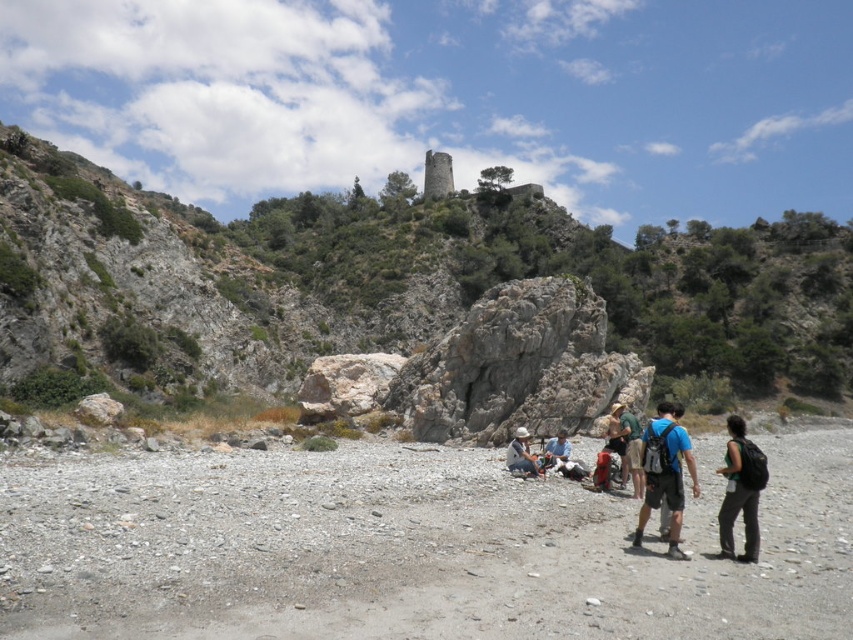
Between point (463, 275) and point (560, 461), which one is positioned in front?

Point (560, 461) is in front.

Is rocky terrain at upper center further to the viewer compared to white fabric bag at center?

Yes, rocky terrain at upper center is behind white fabric bag at center.

Based on the photo, who is more forward, (77, 337) or (544, 460)?

Point (544, 460)

You are a GUI agent. You are given a task and a screenshot of the screen. Output one action in this format:
    pyautogui.click(x=<x>, y=<y>)
    Task: Click on the rocky terrain at upper center
    This screenshot has width=853, height=640.
    Given the screenshot: What is the action you would take?
    pyautogui.click(x=395, y=276)

Does point (642, 458) come in front of point (550, 456)?

That is True.

In the scene shown: Does blue fabric backpack at lower right appear under white fabric bag at center?

Correct, blue fabric backpack at lower right is located below white fabric bag at center.

I want to click on blue fabric backpack at lower right, so click(666, 474).

Is rocky terrain at upper center below matte white helmet at center?

No.

Is rocky terrain at upper center smaller than matte white helmet at center?

No, rocky terrain at upper center is not smaller than matte white helmet at center.

Who is more forward, (444, 241) or (520, 461)?

Point (520, 461)

At what (x,y) coordinates should I click in order to perform the action: click on rocky terrain at upper center. Please return your answer as a coordinate pair (x, y). The height and width of the screenshot is (640, 853). Looking at the image, I should click on (395, 276).